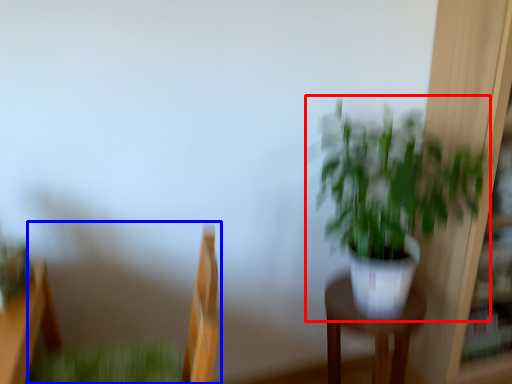
Question: Which point is further to the camera, houseplant (highlighted by a red box) or swivel chair (highlighted by a blue box)?

Choices:
 (A) houseplant
 (B) swivel chair

Answer: (A)